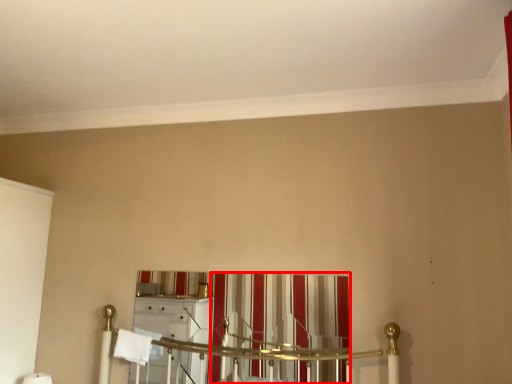
Question: Considering the relative positions of curtain (annotated by the red box) and bath towel in the image provided, where is curtain (annotated by the red box) located with respect to the staircase?

Choices:
 (A) left
 (B) right

Answer: (B)